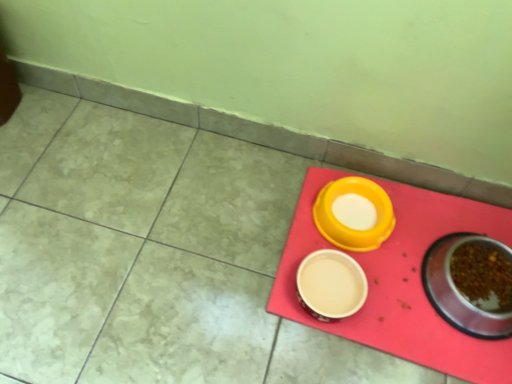
Image resolution: width=512 pixels, height=384 pixels. Find the location of `free location in front of metallic stainless steel bowl at lower right, which is counted as the first tableware, starting from the right`. free location in front of metallic stainless steel bowl at lower right, which is counted as the first tableware, starting from the right is located at coordinates (455, 355).